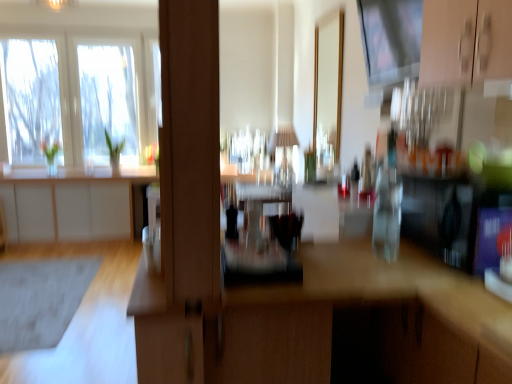
At what (x,y) coordinates should I click in order to perform the action: click on gray matte rug at lower left. Please return your answer as a coordinate pair (x, y). Looking at the image, I should click on (41, 300).

What do you see at coordinates (391, 39) in the screenshot? I see `transparent glass window screen at upper center` at bounding box center [391, 39].

Where is `transparent glass window screen at upper center`? This screenshot has height=384, width=512. transparent glass window screen at upper center is located at coordinates [x=391, y=39].

What is the approximate width of clear glass window at upper left?

The width of clear glass window at upper left is 3.88 inches.

This screenshot has height=384, width=512. Identify the location of wooden desk at center. (327, 324).

Does gray matte rug at lower left appear on the left side of wooden desk at center?

Indeed, gray matte rug at lower left is positioned on the left side of wooden desk at center.

From the image's perspective, is gray matte rug at lower left located beneath wooden desk at center?

Correct, gray matte rug at lower left appears lower than wooden desk at center in the image.

Can you confirm if gray matte rug at lower left is wider than wooden desk at center?

No, gray matte rug at lower left is not wider than wooden desk at center.

Could you tell me if gray matte rug at lower left is facing wooden desk at center?

No.

In the image, there is a white matte cabinet at left. Identify the location of window above it (from the image's perspective). (95, 96).

In the scene shown: Which is closer to the camera, (x=134, y=120) or (x=113, y=216)?

Clearly, point (x=134, y=120) is more distant from the camera than point (x=113, y=216).

Measure the distance from clear glass window at upper left to white matte cabinet at left.

They are 26.21 inches apart.

Between clear glass window at upper left and white matte cabinet at left, which one is positioned behind?

clear glass window at upper left is further from the camera.

Which of these two, clear glass window at upper left or wooden desk at center, is bigger?

wooden desk at center is bigger.

From a real-world perspective, which object rests below the other?

wooden desk at center is physically lower.

Find the location of a particular element. The image size is (512, 384). computer desk that appears on the right of clear glass window at upper left is located at coordinates (327, 324).

Considering the points (126, 147) and (140, 328), which point is behind, point (126, 147) or point (140, 328)?

The point (126, 147) is farther.

From a real-world perspective, does gray matte rug at lower left stand above clear glass window at upper left?

No.

Does gray matte rug at lower left have a greater width compared to clear glass window at upper left?

Correct, the width of gray matte rug at lower left exceeds that of clear glass window at upper left.

From the image's perspective, between transparent glass window screen at upper center and white matte cabinet at left, who is located below?

white matte cabinet at left appears lower in the image.

From the picture: What's the angular difference between transparent glass window screen at upper center and white matte cabinet at left's facing directions?

transparent glass window screen at upper center and white matte cabinet at left are facing 91.4 degrees away from each other.

Does point (369, 38) lie behind point (72, 173)?

No, (369, 38) is closer to viewer.

Which is more to the left, transparent glass window screen at upper center or white matte cabinet at left?

From the viewer's perspective, white matte cabinet at left appears more on the left side.

How far apart are gray matte rug at lower left and white matte cabinet at left?

gray matte rug at lower left and white matte cabinet at left are 1.27 meters apart.

Is point (76, 298) farther from camera compared to point (104, 185)?

No, it is in front of (104, 185).

Is gray matte rug at lower left to the left or to the right of white matte cabinet at left in the image?

gray matte rug at lower left is to the right of white matte cabinet at left.

Considering the relative sizes of gray matte rug at lower left and white matte cabinet at left in the image provided, is gray matte rug at lower left bigger than white matte cabinet at left?

No.

Can we say wooden desk at center lies outside white matte cabinet at left?

Yes, wooden desk at center is located beyond the bounds of white matte cabinet at left.

Considering the relative sizes of wooden desk at center and white matte cabinet at left in the image provided, is wooden desk at center bigger than white matte cabinet at left?

Correct, wooden desk at center is larger in size than white matte cabinet at left.

Does wooden desk at center lie in front of white matte cabinet at left?

Yes.

From the image's perspective, is wooden desk at center above or below white matte cabinet at left?

wooden desk at center is situated lower than white matte cabinet at left in the image.

You are a GUI agent. You are given a task and a screenshot of the screen. Output one action in this format:
    pyautogui.click(x=<x>, y=<y>)
    Task: Click on the mat below the wooden desk at center (from a real-world perspective)
    Image resolution: width=512 pixels, height=384 pixels.
    Given the screenshot: What is the action you would take?
    pyautogui.click(x=41, y=300)

Locate an element on the screen. The height and width of the screenshot is (384, 512). cabinetry below the clear glass window at upper left (from the image's perspective) is located at coordinates (72, 202).

Estimate the real-world distances between objects in this image. Which object is further from gray matte rug at lower left, transparent glass window screen at upper center or wooden desk at center?

transparent glass window screen at upper center lies further to gray matte rug at lower left than the other object.

Based on their spatial positions, is white matte cabinet at left or wooden desk at center closer to gray matte rug at lower left?

white matte cabinet at left lies closer to gray matte rug at lower left than the other object.

From the image, which object appears to be nearer to clear glass window at upper left, white matte cabinet at left or wooden desk at center?

Among the two, white matte cabinet at left is located nearer to clear glass window at upper left.

Estimate the real-world distances between objects in this image. Which object is closer to transparent glass window screen at upper center, gray matte rug at lower left or wooden desk at center?

wooden desk at center is positioned closer to the anchor transparent glass window screen at upper center.

When comparing their distances from clear glass window at upper left, does transparent glass window screen at upper center or gray matte rug at lower left seem further?

transparent glass window screen at upper center lies further to clear glass window at upper left than the other object.

Based on their spatial positions, is wooden desk at center or clear glass window at upper left further from transparent glass window screen at upper center?

clear glass window at upper left.

Which object lies nearer to the anchor point wooden desk at center, transparent glass window screen at upper center or white matte cabinet at left?

transparent glass window screen at upper center is positioned closer to the anchor wooden desk at center.

Which object lies nearer to the anchor point clear glass window at upper left, gray matte rug at lower left or wooden desk at center?

Among the two, gray matte rug at lower left is located nearer to clear glass window at upper left.

Identify the location of mat located between wooden desk at center and white matte cabinet at left in the depth direction. The width and height of the screenshot is (512, 384). (41, 300).

The width and height of the screenshot is (512, 384). In order to click on window between white matte cabinet at left and transparent glass window screen at upper center in the horizontal direction in this screenshot , I will do `click(95, 96)`.

Identify the location of window screen between wooden desk at center and clear glass window at upper left in the front-back direction. (391, 39).

You are a GUI agent. You are given a task and a screenshot of the screen. Output one action in this format:
    pyautogui.click(x=<x>, y=<y>)
    Task: Click on the cabinetry located between wooden desk at center and clear glass window at upper left in the depth direction
    Image resolution: width=512 pixels, height=384 pixels.
    Given the screenshot: What is the action you would take?
    pyautogui.click(x=72, y=202)